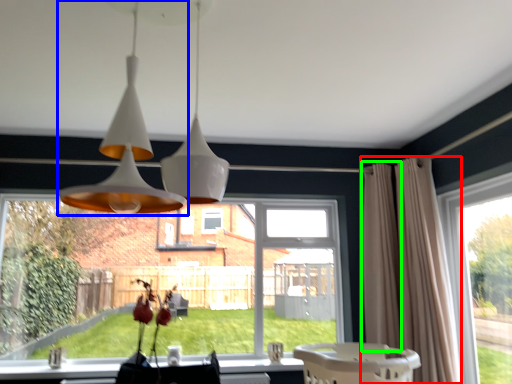
Question: Which is farther away from curtain (highlighted by a red box)? lamp (highlighted by a blue box) or curtain (highlighted by a green box)?

Choices:
 (A) lamp
 (B) curtain

Answer: (A)